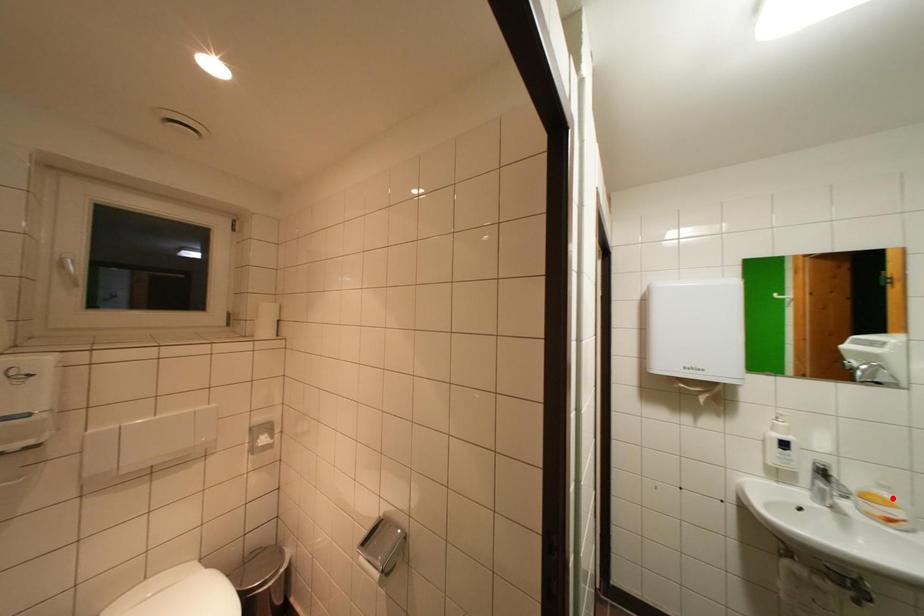
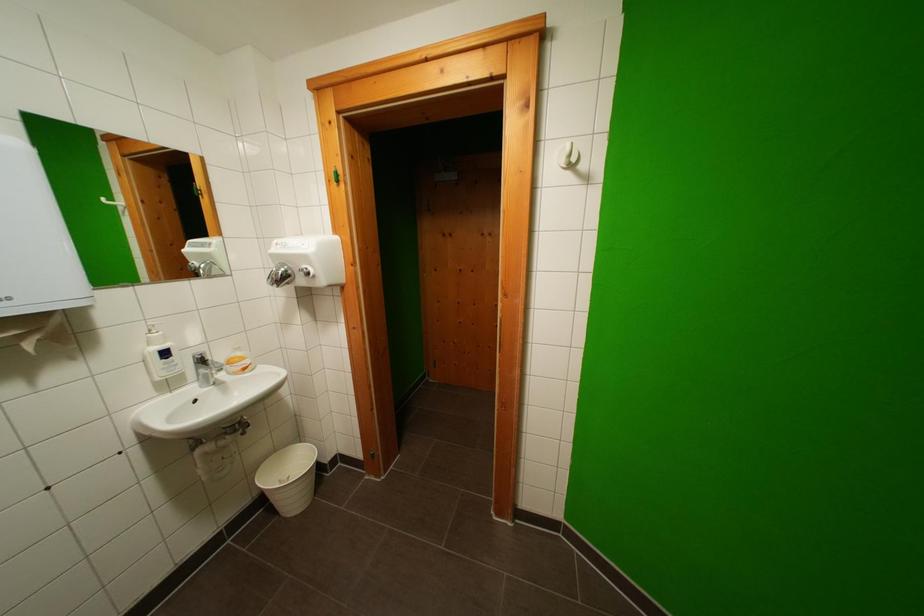
The point at the highlighted location is marked in the first image. Where is the corresponding point in the second image?

(246, 357)